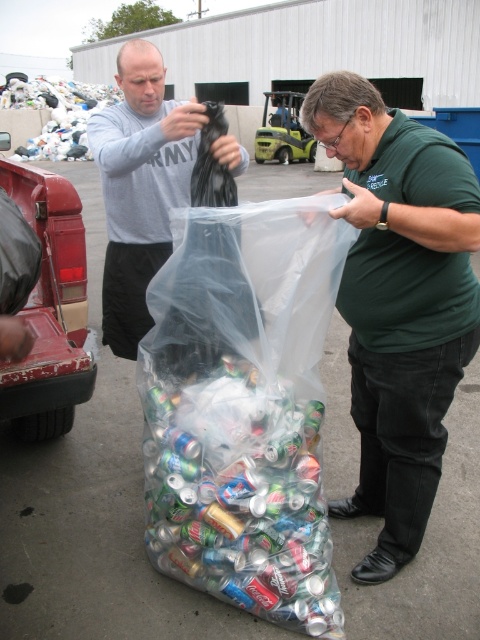
Who is positioned more to the right, translucent plastic bag at center or gray matte shirt at upper left?

From the viewer's perspective, translucent plastic bag at center appears more on the right side.

Is translucent plastic bag at center positioned behind gray matte shirt at upper left?

No.

Find the location of a particular element. translucent plastic bag at center is located at coordinates (243, 406).

Which is more to the left, translucent plastic bag at center or plastic bag at upper left?

From the viewer's perspective, plastic bag at upper left appears more on the left side.

Which is above, translucent plastic bag at center or plastic bag at upper left?

Positioned higher is plastic bag at upper left.

I want to click on translucent plastic bag at center, so click(243, 406).

Find the location of a particular element. translucent plastic bag at center is located at coordinates [x=243, y=406].

Between green matte shirt at center and gray matte shirt at upper left, which one appears on the right side from the viewer's perspective?

From the viewer's perspective, green matte shirt at center appears more on the right side.

Does green matte shirt at center have a lesser width compared to gray matte shirt at upper left?

Correct, green matte shirt at center's width is less than gray matte shirt at upper left's.

Is point (407, 170) closer to viewer compared to point (121, 330)?

Yes, point (407, 170) is closer to viewer.

This screenshot has height=640, width=480. Identify the location of green matte shirt at center. (398, 301).